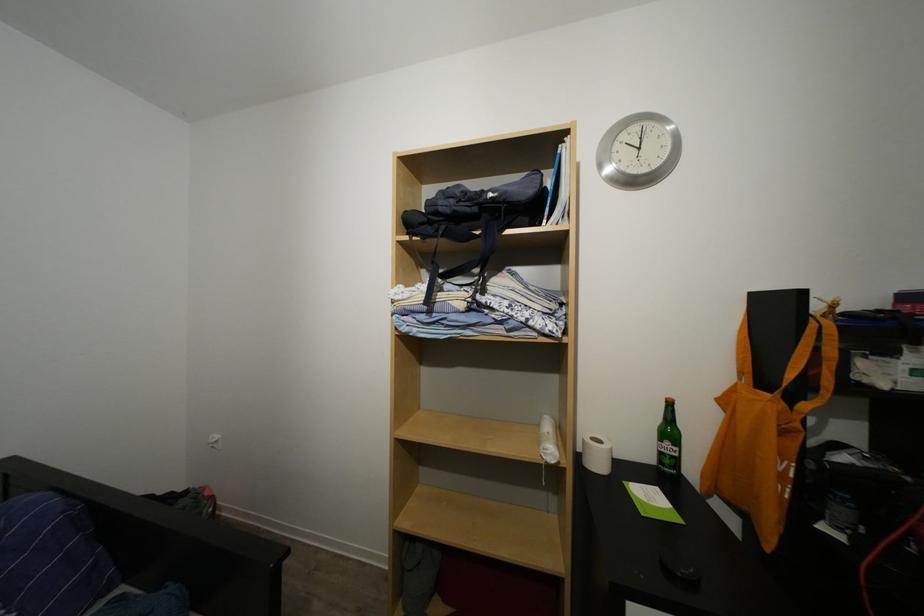
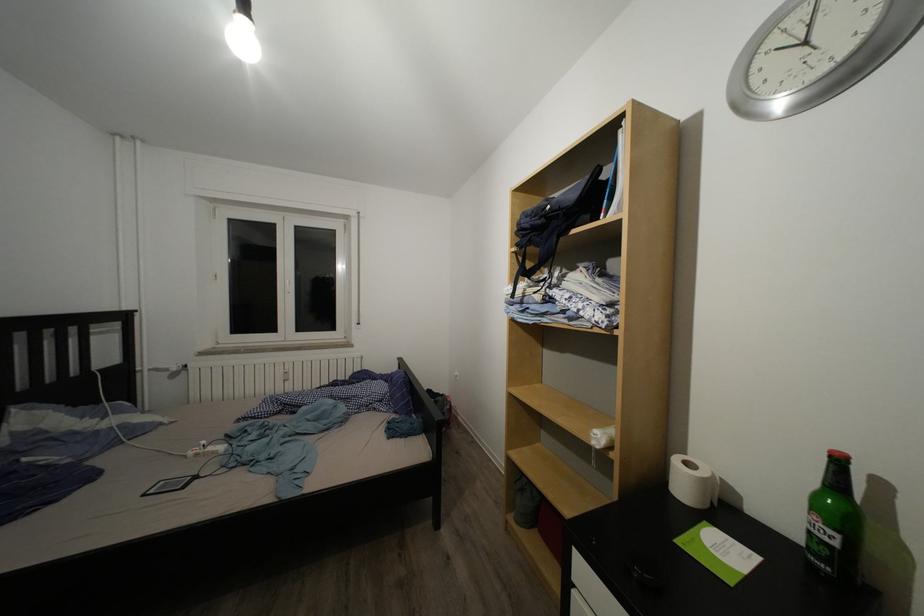
Question: The camera is either moving clockwise (left) or counter-clockwise (right) around the object. The first image is from the beginning of the video and the second image is from the end. Is the camera moving left or right when shooting the video?

Choices:
 (A) Left
 (B) Right

Answer: (B)